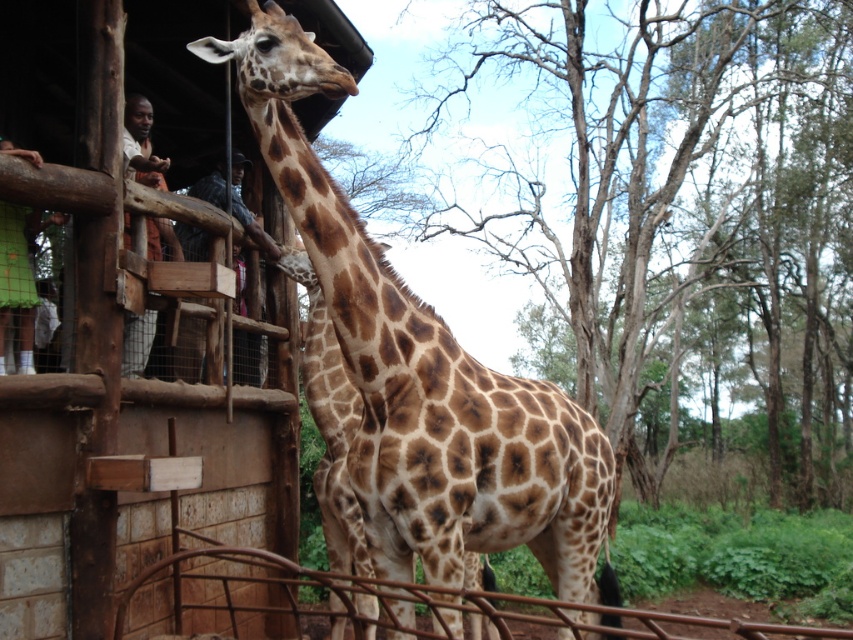
You are a visitor at the zoo and want to take a photo of the brown spotted giraffe at center through the brown metal rail at lower center. Will the giraffe be fully visible in the photo if you stand directly in front of the rail?

The brown spotted giraffe at center is taller than the brown metal rail at lower center, so yes, the giraffe will be fully visible in the photo as its height exceeds the rail.

You are a zookeeper who needs to place a small sign on the brown metal rail at lower center. You have a green mesh shirt at left nearby. Which object should you place the sign on, and why?

The brown metal rail at lower center is the correct object to place the sign on because it is specifically mentioned as the location for the sign. The green mesh shirt at left is a separate object and not intended for signage.